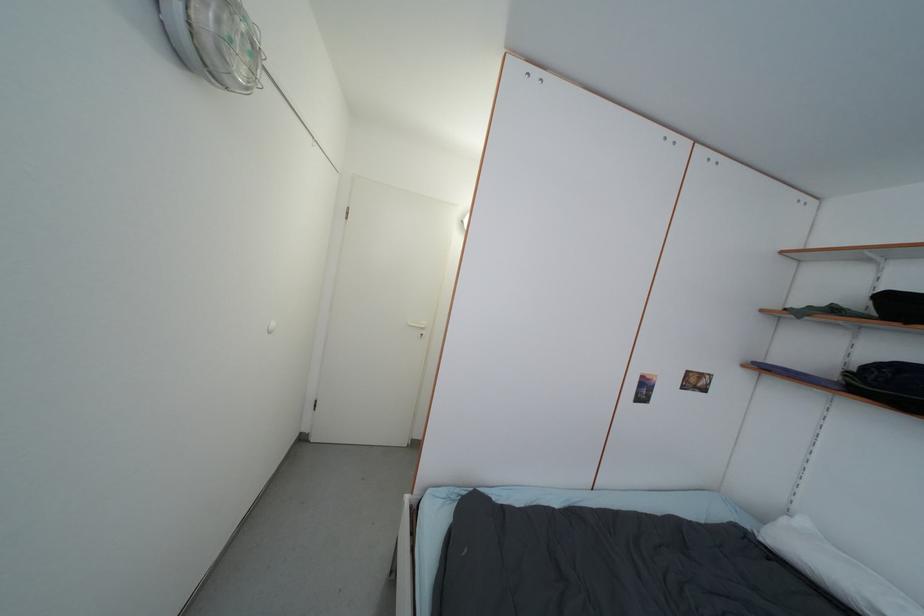
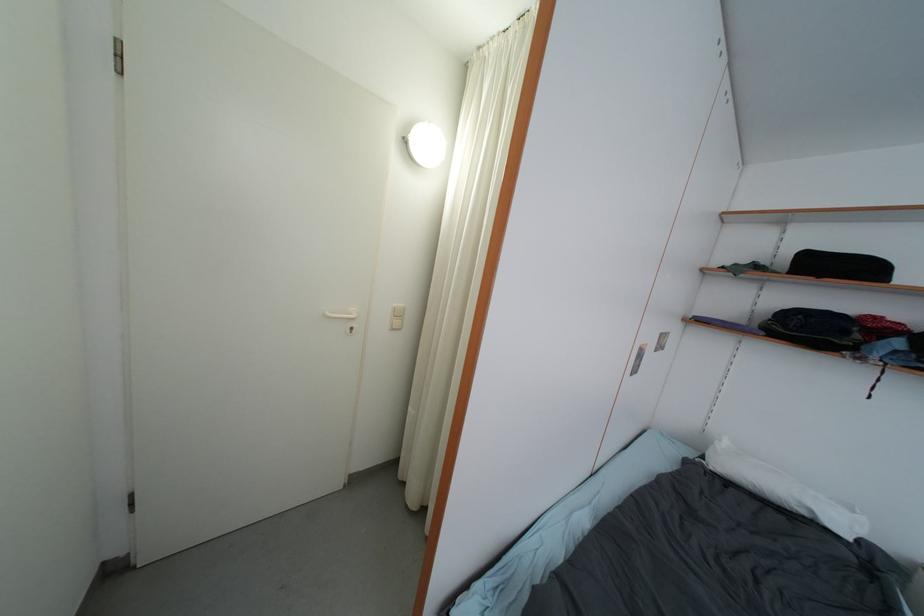
Question: How did the camera likely rotate?

Choices:
 (A) Left
 (B) Right
 (C) Up
 (D) Down

Answer: (B)